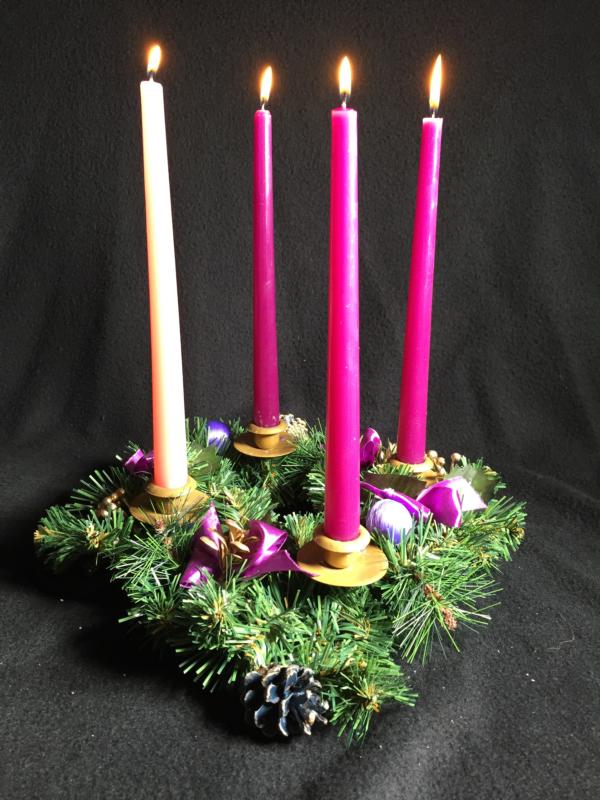
The height and width of the screenshot is (800, 600). In order to click on white candle in this screenshot , I will do `click(162, 376)`.